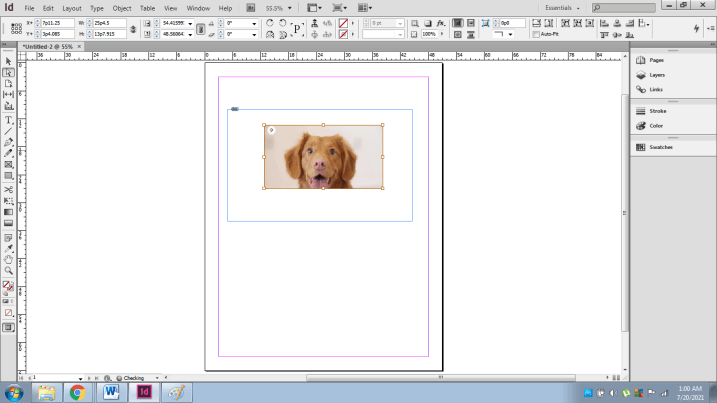
What are the coordinates of `windows bottom thing` in the screenshot? It's located at (24, 390).